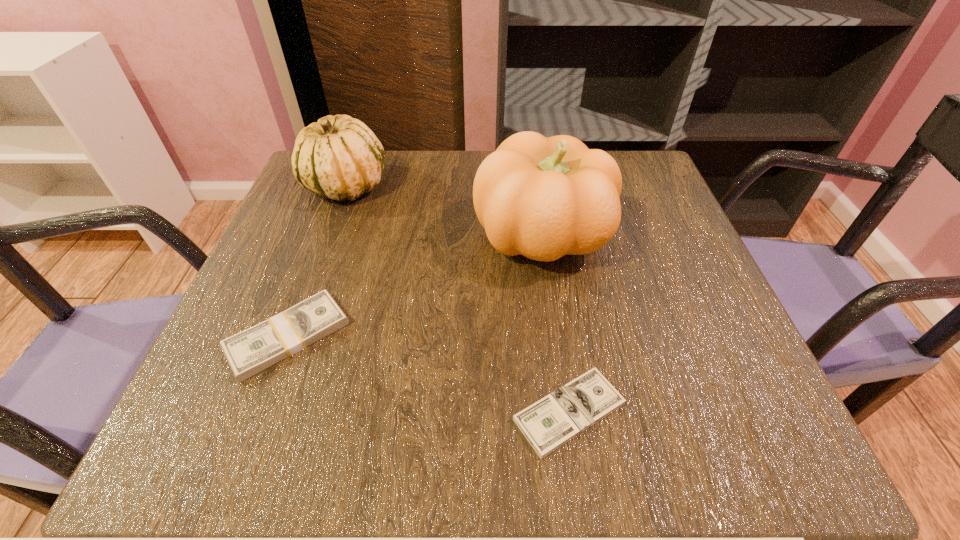
Locate an element on the screen. The width and height of the screenshot is (960, 540). free area in between the pumpkin and the shorter dollar is located at coordinates (556, 323).

Where is `empty space between the taller dollar and the pumpkin`? This screenshot has height=540, width=960. empty space between the taller dollar and the pumpkin is located at coordinates (415, 286).

Locate an element on the screen. vacant space in between the pumpkin and the right dollar is located at coordinates (556, 323).

I want to click on free area in between the tallest object and the taller dollar, so click(415, 286).

Select which object appears as the second closest to the tallest object. Please provide its 2D coordinates. Your answer should be formatted as a tuple, i.e. [(x, y)], where the tuple contains the x and y coordinates of a point satisfying the conditions above.

[(338, 157)]

Where is `object identified as the second closest to the right dollar`? The width and height of the screenshot is (960, 540). object identified as the second closest to the right dollar is located at coordinates (253, 350).

The image size is (960, 540). What are the coordinates of `vacant region that satisfies the following two spatial constraints: 1. on the front side of the pumpkin; 2. on the left side of the gourd` in the screenshot? It's located at (326, 235).

Where is `vacant space that satisfies the following two spatial constraints: 1. on the front side of the third shortest object; 2. on the left side of the tallest object`? Image resolution: width=960 pixels, height=540 pixels. vacant space that satisfies the following two spatial constraints: 1. on the front side of the third shortest object; 2. on the left side of the tallest object is located at coordinates (326, 235).

The width and height of the screenshot is (960, 540). Identify the location of vacant space that satisfies the following two spatial constraints: 1. on the front side of the shorter dollar; 2. on the right side of the pumpkin. (568, 411).